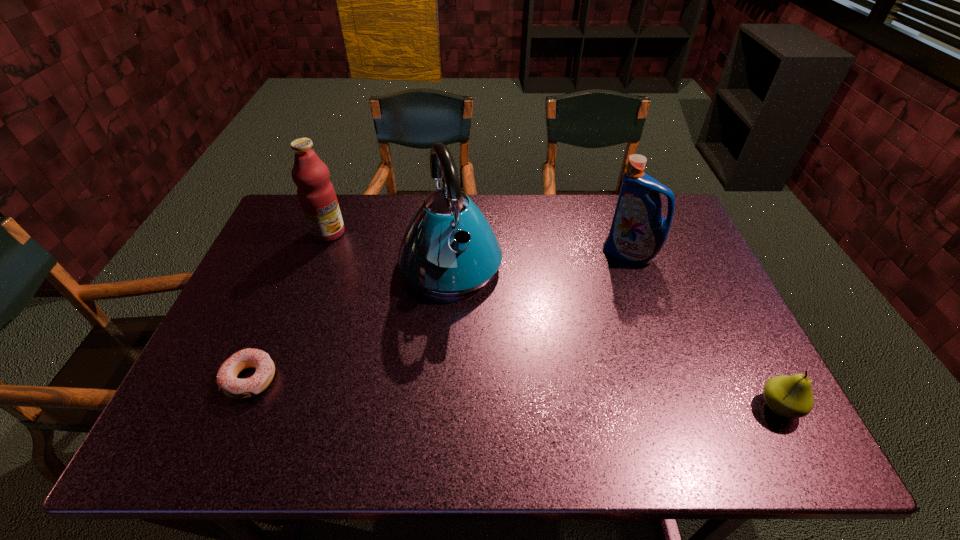
Identify the location of free space on the desktop that is between the shortest object and the pear and is positioned at the spout of the third object from right to left. This screenshot has height=540, width=960. (506, 392).

The height and width of the screenshot is (540, 960). I want to click on vacant space on the desktop that is between the shortest object and the second shortest object and is positioned on the label of the fruit juice, so click(516, 393).

Identify the location of free space on the desktop that is between the doughnut and the rightmost object and is positioned on the label of the second object from right to left. The width and height of the screenshot is (960, 540). (484, 391).